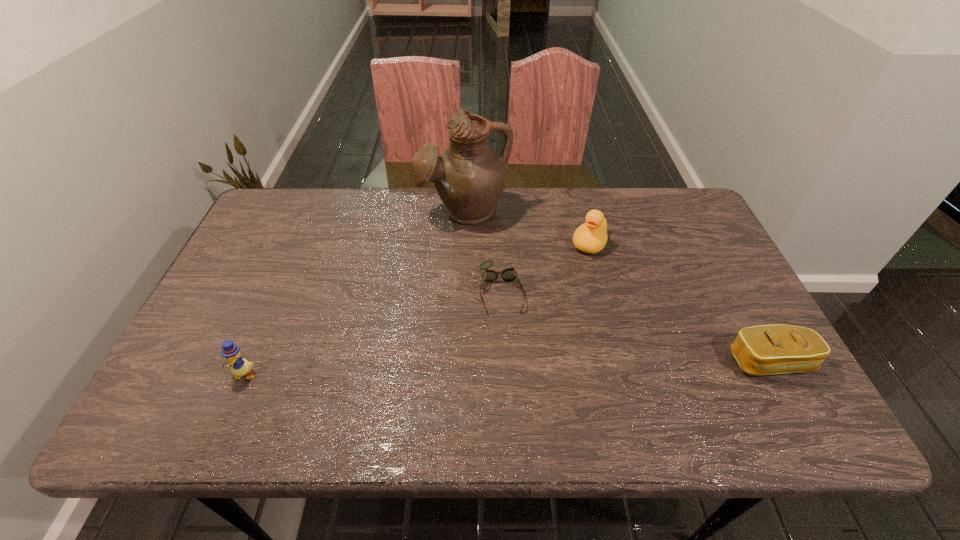
At what (x,y) coordinates should I click in order to perform the action: click on unoccupied area between the rightmost object and the leftmost object. Please return your answer as a coordinate pair (x, y). This screenshot has width=960, height=540. Looking at the image, I should click on (508, 368).

Image resolution: width=960 pixels, height=540 pixels. Identify the location of vacant area that lies between the fourth object from left to right and the rightmost object. (680, 302).

Where is `free spot between the duck and the pitcher`? This screenshot has height=540, width=960. free spot between the duck and the pitcher is located at coordinates (527, 227).

At what (x,y) coordinates should I click in order to perform the action: click on blank region between the tallest object and the leftmost object. Please return your answer as a coordinate pair (x, y). The width and height of the screenshot is (960, 540). Looking at the image, I should click on point(354,293).

Identify the location of blank region between the rightmost object and the third nearest object. (636, 327).

Identify the location of free spot between the pitcher and the rightmost object. (617, 287).

Identify the location of free space between the duck and the pitcher. point(527,227).

Find the location of `unoccupied area between the shortest object and the pitcher`. unoccupied area between the shortest object and the pitcher is located at coordinates (483, 251).

This screenshot has height=540, width=960. Find the location of `empty space that is in between the second shortest object and the second object from right to left`. empty space that is in between the second shortest object and the second object from right to left is located at coordinates (680, 302).

Choose which object is the third nearest neighbor to the leftmost object. Please provide its 2D coordinates. Your answer should be formatted as a tuple, i.e. [(x, y)], where the tuple contains the x and y coordinates of a point satisfying the conditions above.

[(591, 237)]